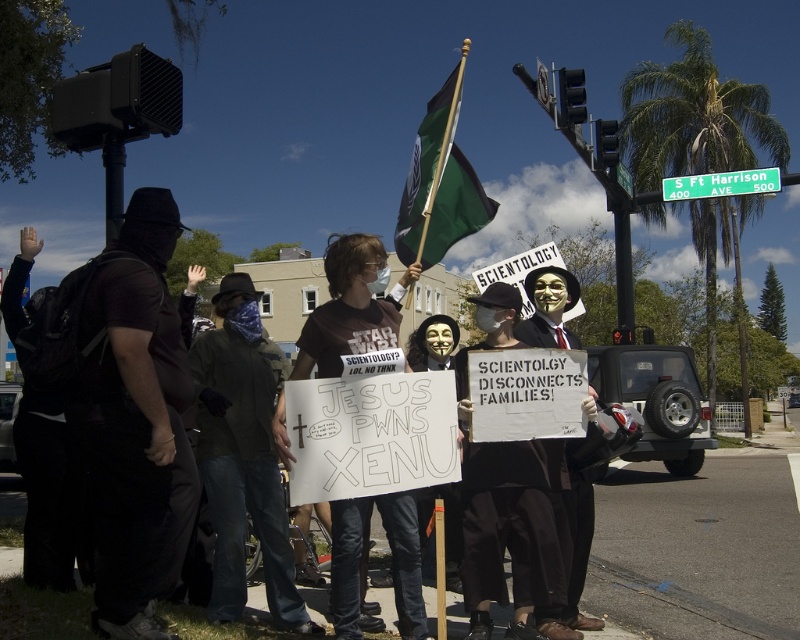
You are a photographer trying to capture a photo of the protest. You want to ensure both the black matte clothing at left and the matte black suit at center are visible in the frame. Based on their positions, which object should be placed closer to the left edge of the photo?

The black matte clothing at left should be placed closer to the left edge of the photo since it is positioned to the left of the matte black suit at center.

You are a photographer standing at the street corner where the protest is happening. You want to take a photo that includes both the point at position (393, 243) and the point at position (772, 172). Which point is closer to you, the photographer?

The point at position (393, 243) is closer to the photographer because it is further to the viewer than the point at position (772, 172).

You are a photographer trying to capture a clear shot of both the green fabric flag at center and the matte black suit at center from your current position. Based on their positions, will you be able to see both objects in the same frame without moving your camera? Explain your reasoning.

The green fabric flag at center is located above the matte black suit at center, so yes, you can see both in the same frame by adjusting the camera angle to capture the flag above and the suit below without moving the camera.